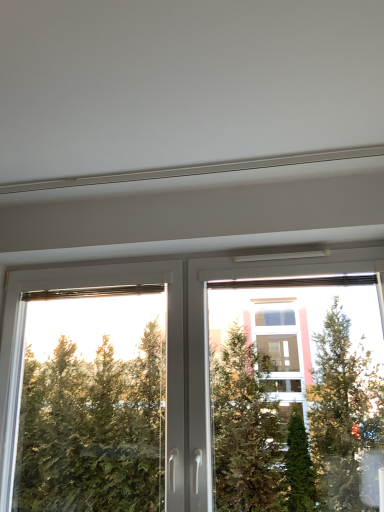
This screenshot has height=512, width=384. Describe the element at coordinates (97, 292) in the screenshot. I see `transparent glass window at center` at that location.

Identify the location of transparent glass window at center. (97, 292).

Locate an element on the screen. transparent glass window at center is located at coordinates (97, 292).